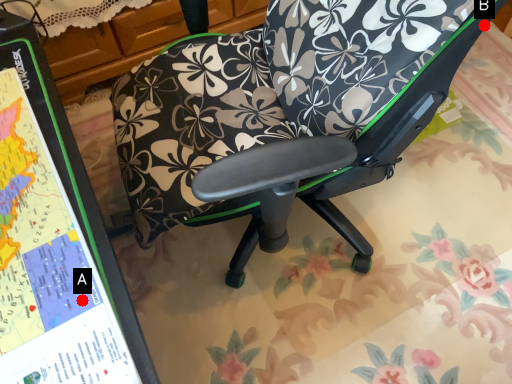
Question: Two points are circled on the image, labeled by A and B beside each circle. Which point is closer to the camera taking this photo?

Choices:
 (A) A is closer
 (B) B is closer

Answer: (A)